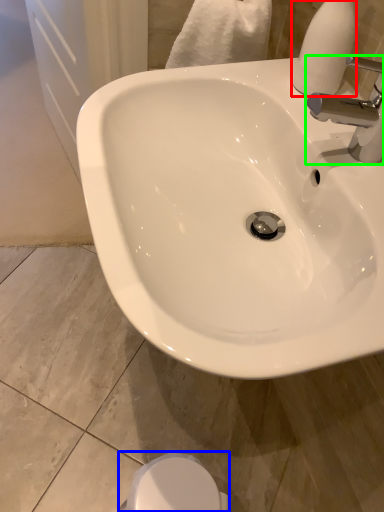
Question: Considering the real-world distances, which object is farthest from soap dispenser (highlighted by a red box)? bidet (highlighted by a blue box) or tap (highlighted by a green box)?

Choices:
 (A) bidet
 (B) tap

Answer: (A)